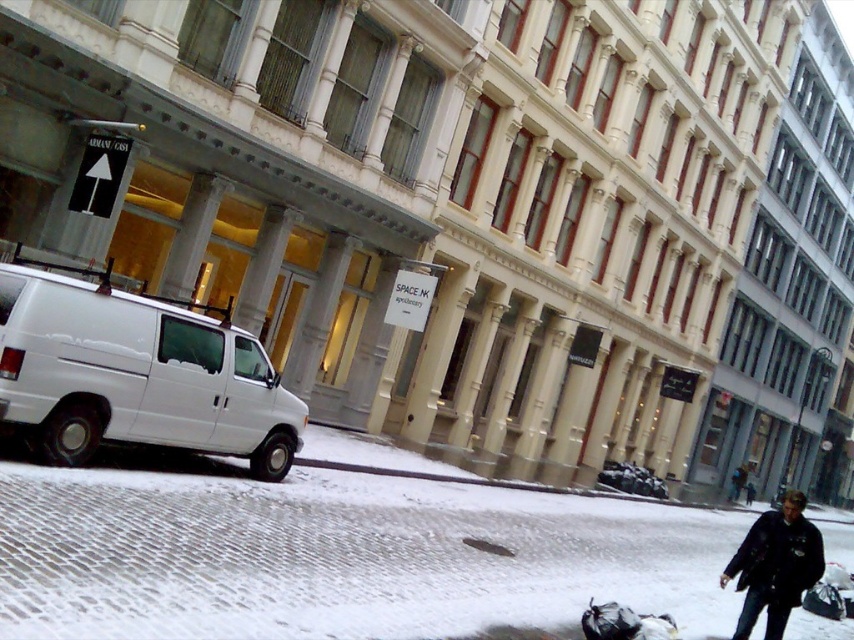
Looking at this image, between white matte van at left and black leather jacket at lower right, which one appears on the left side from the viewer's perspective?

Positioned to the left is white matte van at left.

Is white matte van at left thinner than black leather jacket at lower right?

Indeed, white matte van at left has a lesser width compared to black leather jacket at lower right.

Where is `white matte van at left`? white matte van at left is located at coordinates (135, 376).

Is snowy cobblestone pavement at lower left wider than white matte van at left?

Correct, the width of snowy cobblestone pavement at lower left exceeds that of white matte van at left.

Who is shorter, snowy cobblestone pavement at lower left or white matte van at left?

With less height is white matte van at left.

Does point (232, 614) come behind point (39, 429)?

No.

You are a GUI agent. You are given a task and a screenshot of the screen. Output one action in this format:
    pyautogui.click(x=<x>, y=<y>)
    Task: Click on the snowy cobblestone pavement at lower left
    This screenshot has width=854, height=640.
    Given the screenshot: What is the action you would take?
    pyautogui.click(x=337, y=556)

Can you confirm if snowy cobblestone pavement at lower left is shorter than black leather jacket at lower right?

In fact, snowy cobblestone pavement at lower left may be taller than black leather jacket at lower right.

Does snowy cobblestone pavement at lower left appear on the left side of black leather jacket at lower right?

Yes, snowy cobblestone pavement at lower left is to the left of black leather jacket at lower right.

Is point (212, 582) closer to camera compared to point (743, 547)?

Yes.

Locate an element on the screen. This screenshot has width=854, height=640. snowy cobblestone pavement at lower left is located at coordinates (337, 556).